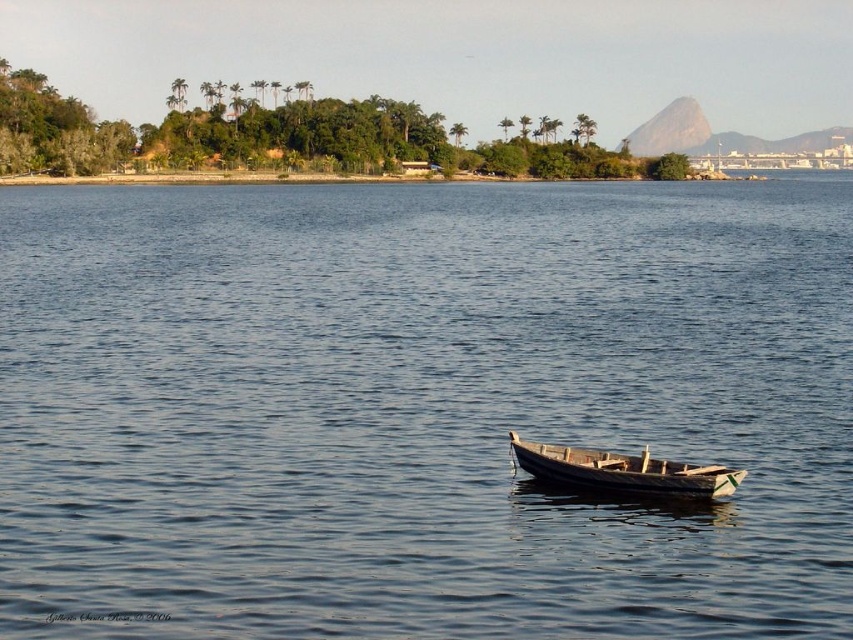
Question: Which of the following is the farthest from the observer?

Choices:
 (A) blue water at center
 (B) wooden boat at center

Answer: (B)

Question: Does blue water at center come behind wooden boat at center?

Choices:
 (A) no
 (B) yes

Answer: (A)

Question: Which object appears closest to the camera in this image?

Choices:
 (A) wooden boat at center
 (B) blue water at center

Answer: (B)

Question: Is blue water at center wider than wooden boat at center?

Choices:
 (A) yes
 (B) no

Answer: (A)

Question: Which point is farther to the camera?

Choices:
 (A) blue water at center
 (B) wooden boat at center

Answer: (B)

Question: Does blue water at center appear on the right side of wooden boat at center?

Choices:
 (A) yes
 (B) no

Answer: (A)